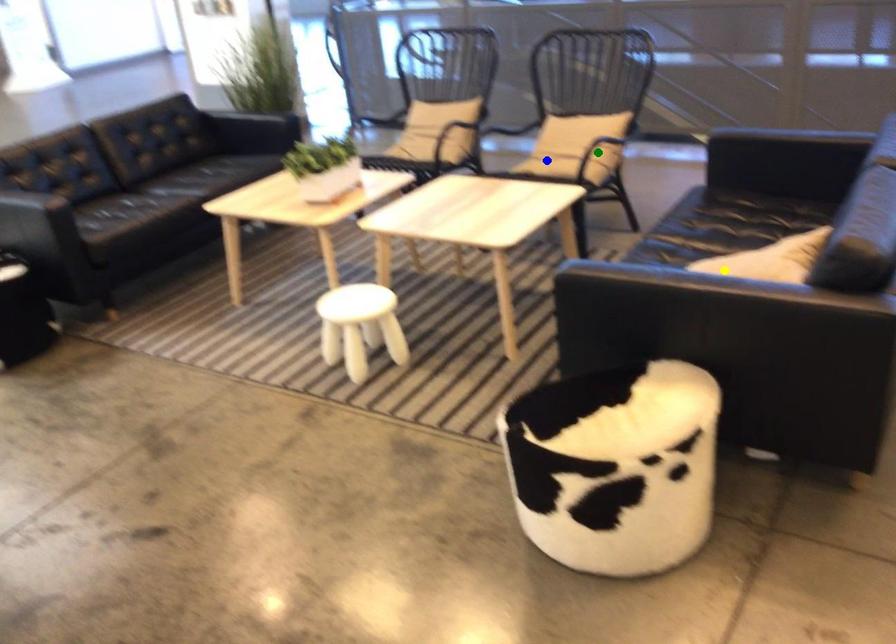
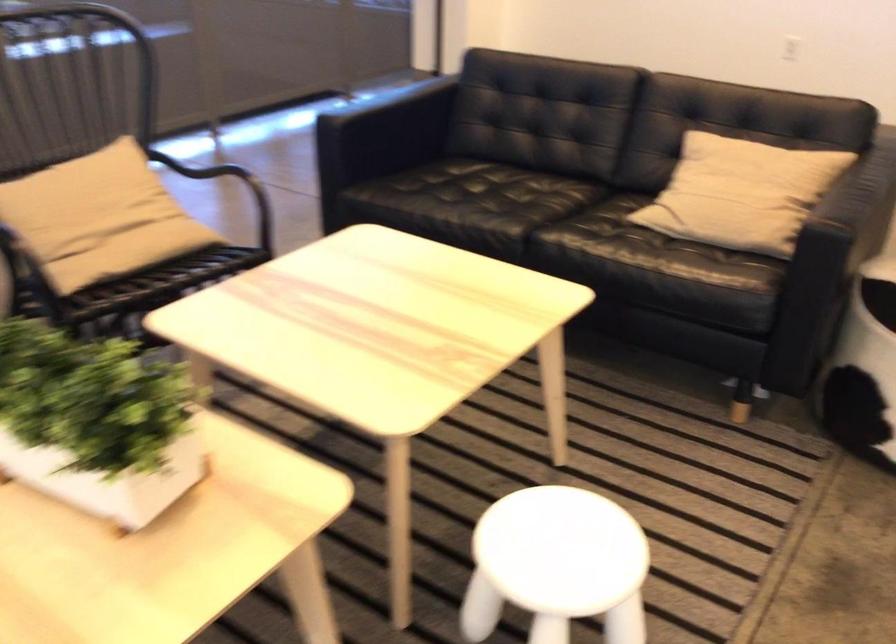
I am providing you with two images of the same scene from different viewpoints. Three points are marked in image1. Which point corresponds to a part or object that is occluded in image2?In image1, three points are marked. Which of them correspond to a part or object that is occluded in image2?Among the three points shown in image1, which one corresponds to a part or object that is no longer visible due to occlusion in image2?

green point cannot be seen in image2.